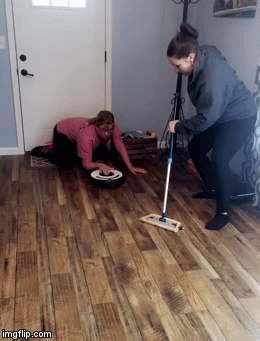
The width and height of the screenshot is (260, 341). Find the location of `mop head`. mop head is located at coordinates (169, 227).